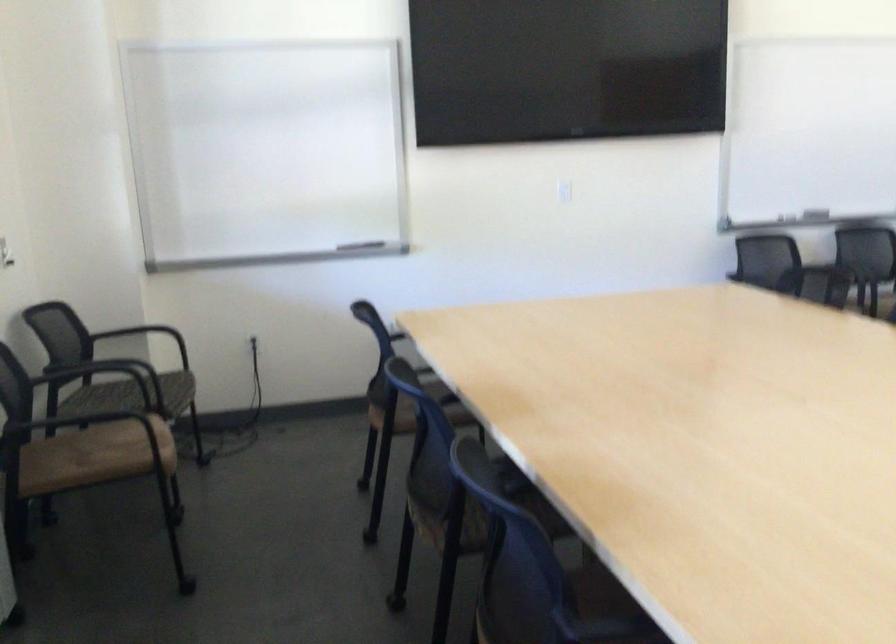
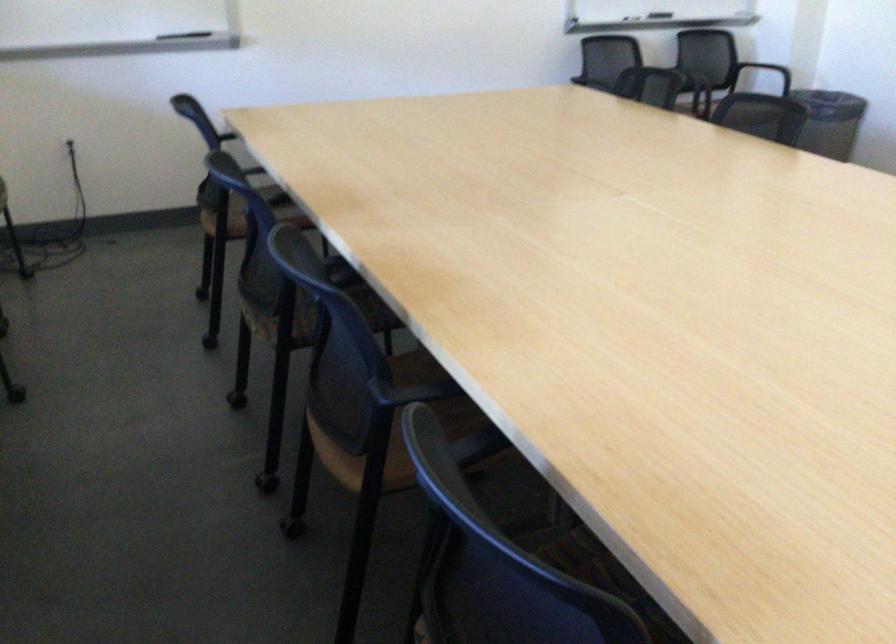
Locate, in the second image, the point that corresponds to point (768, 247) in the first image.

(607, 57)